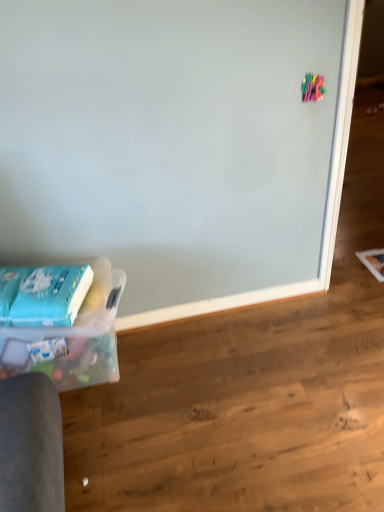
Question: Considering the relative sizes of clear plastic container at lower left and blue matte paperback book at lower left in the image provided, is clear plastic container at lower left wider than blue matte paperback book at lower left?

Choices:
 (A) yes
 (B) no

Answer: (A)

Question: Does clear plastic container at lower left have a lesser height compared to blue matte paperback book at lower left?

Choices:
 (A) yes
 (B) no

Answer: (B)

Question: Is clear plastic container at lower left to the left of blue matte paperback book at lower left from the viewer's perspective?

Choices:
 (A) yes
 (B) no

Answer: (B)

Question: Are clear plastic container at lower left and blue matte paperback book at lower left located far from each other?

Choices:
 (A) yes
 (B) no

Answer: (B)

Question: Is clear plastic container at lower left behind blue matte paperback book at lower left?

Choices:
 (A) no
 (B) yes

Answer: (A)

Question: Is clear plastic container at lower left directly adjacent to blue matte paperback book at lower left?

Choices:
 (A) no
 (B) yes

Answer: (A)

Question: Considering the relative sizes of blue matte paperback book at lower left and clear plastic container at lower left in the image provided, is blue matte paperback book at lower left taller than clear plastic container at lower left?

Choices:
 (A) no
 (B) yes

Answer: (A)

Question: From the image's perspective, is blue matte paperback book at lower left located beneath clear plastic container at lower left?

Choices:
 (A) no
 (B) yes

Answer: (A)

Question: Can you confirm if blue matte paperback book at lower left is smaller than clear plastic container at lower left?

Choices:
 (A) no
 (B) yes

Answer: (B)

Question: Would you say clear plastic container at lower left is part of blue matte paperback book at lower left's contents?

Choices:
 (A) yes
 (B) no

Answer: (B)

Question: From a real-world perspective, is blue matte paperback book at lower left located beneath clear plastic container at lower left?

Choices:
 (A) no
 (B) yes

Answer: (A)

Question: Is blue matte paperback book at lower left shorter than clear plastic container at lower left?

Choices:
 (A) yes
 (B) no

Answer: (A)

Question: Considering the positions of clear plastic container at lower left and blue matte paperback book at lower left in the image, is clear plastic container at lower left wider or thinner than blue matte paperback book at lower left?

Choices:
 (A) wide
 (B) thin

Answer: (A)